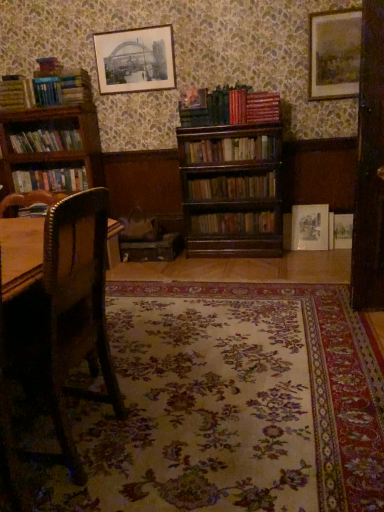
Question: From their relative heights in the image, would you say wooden bookshelf at center, the fourth book positioned from the top, is taller or shorter than wooden bookshelf at left, which is the 5th book in bottom-to-top order?

Choices:
 (A) tall
 (B) short

Answer: (B)

Question: In the image, is wooden bookshelf at center, which ranks as the fourth book in bottom-to-top order, positioned in front of or behind wooden bookshelf at left, which is the 5th book in bottom-to-top order?

Choices:
 (A) front
 (B) behind

Answer: (A)

Question: Which object is the farthest from the wooden bookshelf at left, acting as the 3th book starting from the top?

Choices:
 (A) matte paper picture frame at upper right, which is counted as the 2th picture frame, starting from the left
 (B) brown wooden bookcase at left
 (C) wooden picture frame at upper right, acting as the third picture frame starting from the left
 (D) wooden bookshelf at center, marked as the seventh book in a top-to-bottom arrangement
 (E) striped fabric book at center, which is the 2th book in top-to-bottom order

Answer: (C)

Question: Which object is the closest to the wooden picture frame at upper right, which is counted as the second picture frame, starting from the bottom?

Choices:
 (A) wooden polished chair at left
 (B) wooden bookshelf at center, which ranks as the fourth book in bottom-to-top order
 (C) brown wooden bookcase at left
 (D) wooden bookshelf at center, which is the 1th book in bottom-to-top order
 (E) wooden bookshelf at center, the 2th book ordered from the bottom

Answer: (B)